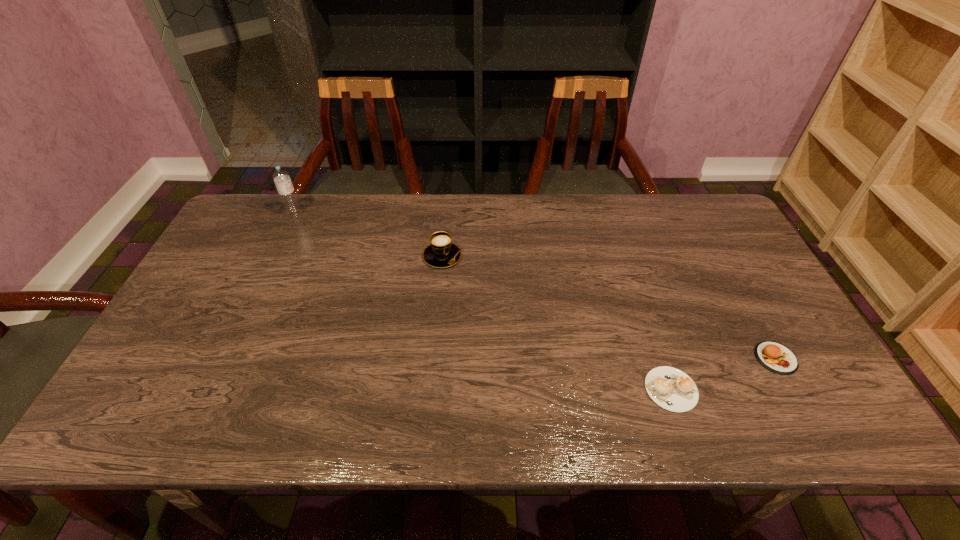
This screenshot has width=960, height=540. Identify the location of water bottle. (286, 191).

Locate an element on the screen. the tallest object is located at coordinates (286, 191).

You are a GUI agent. You are given a task and a screenshot of the screen. Output one action in this format:
    pyautogui.click(x=<x>, y=<y>)
    Task: Click on the second tallest object
    The height and width of the screenshot is (540, 960).
    Given the screenshot: What is the action you would take?
    pyautogui.click(x=441, y=253)

The height and width of the screenshot is (540, 960). Identify the location of the taller cappuccino. (441, 253).

The width and height of the screenshot is (960, 540). In order to click on the second shortest object in this screenshot , I will do `click(777, 358)`.

Identify the location of patty (food). The width and height of the screenshot is (960, 540). (777, 358).

At what (x,y) coordinates should I click in order to perform the action: click on the second object from right to left. Please return your answer as a coordinate pair (x, y). Looking at the image, I should click on (670, 388).

At what (x,y) coordinates should I click in order to perform the action: click on the right cappuccino. Please return your answer as a coordinate pair (x, y). This screenshot has width=960, height=540. Looking at the image, I should click on (670, 388).

The image size is (960, 540). What are the coordinates of `vacant region located on the left of the leftmost object` in the screenshot? It's located at (260, 215).

Locate an element on the screen. The image size is (960, 540). free location located 0.310m on the right of the third nearest object is located at coordinates (565, 256).